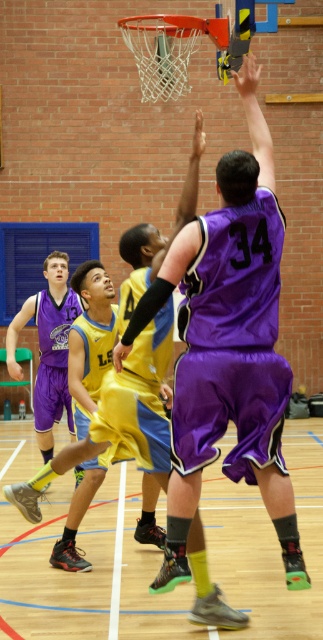
Between point (246, 465) and point (49, 314), which one is positioned behind?

The point (49, 314) is behind.

Is purple fabric shorts at center positioned behind purple satin jersey at center?

No, it is in front of purple satin jersey at center.

Who is more distant from viewer, (275, 330) or (59, 374)?

The point (59, 374) is more distant.

This screenshot has width=323, height=640. What are the coordinates of `purple fabric shorts at center` in the screenshot? It's located at (231, 342).

Is purple fabric shorts at center positioned behind matte purple shorts at left?

No, it is in front of matte purple shorts at left.

Is point (218, 424) farther from viewer compared to point (43, 388)?

No, it is not.

Locate an element on the screen. purple fabric shorts at center is located at coordinates (231, 342).

Based on the photo, which is more to the left, matte purple shorts at left or purple satin jersey at center?

matte purple shorts at left is more to the left.

Who is more forward, (65, 300) or (60, 330)?

Point (60, 330) is more forward.

The height and width of the screenshot is (640, 323). What are the coordinates of `matte purple shorts at left` in the screenshot? It's located at (49, 348).